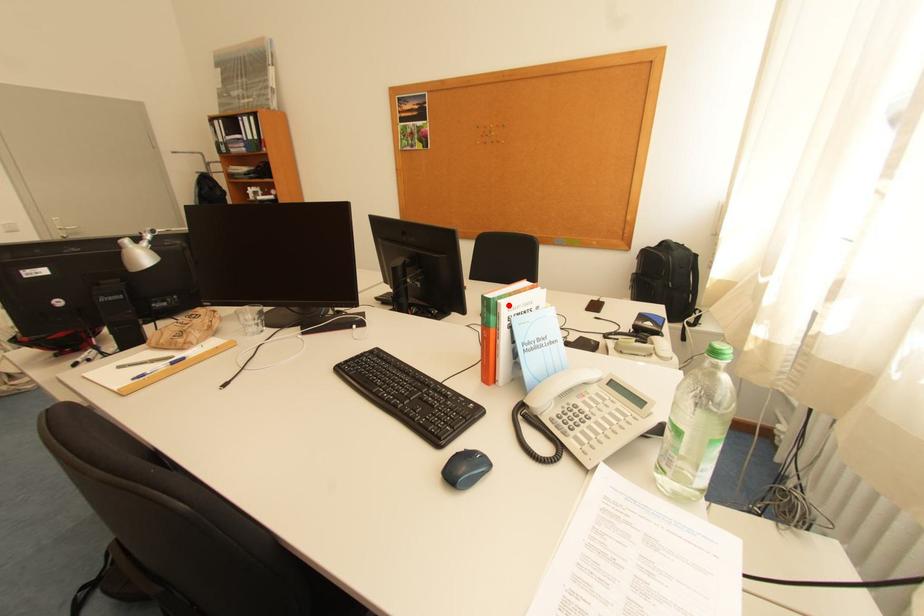
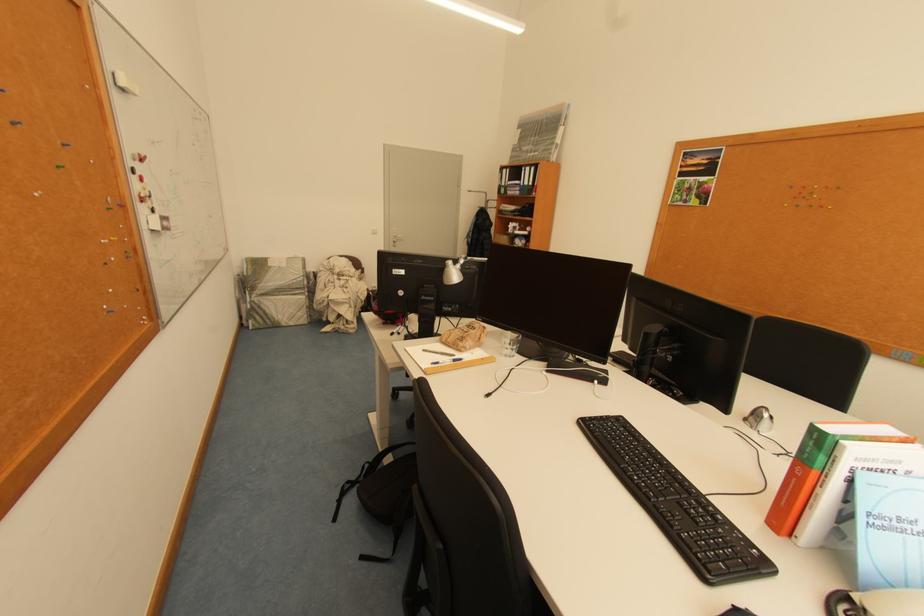
Where in the second image is the point corresponding to the highlighted location from the first image?

(853, 448)